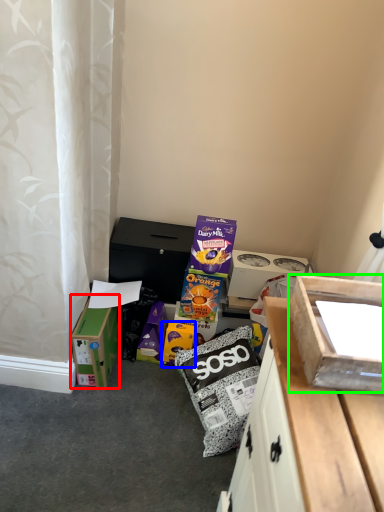
Question: Estimate the real-world distances between objects in this image. Which object is closer to box (highlighted by a red box), cardboard box (highlighted by a blue box) or box (highlighted by a green box)?

Choices:
 (A) cardboard box
 (B) box

Answer: (A)